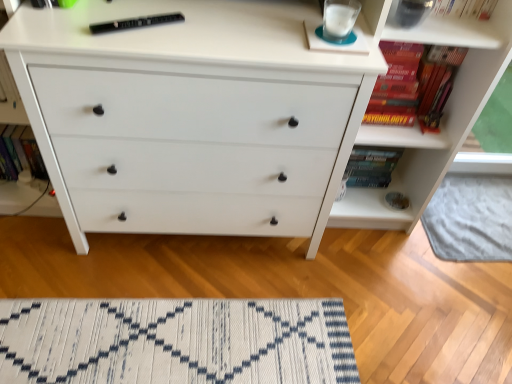
Question: Is white woven mat at lower center further to camera compared to black plastic remote at upper center, the third book viewed from the right?

Choices:
 (A) no
 (B) yes

Answer: (B)

Question: Is black plastic remote at upper center, placed as the second book when sorted from left to right, a part of white woven mat at lower center?

Choices:
 (A) yes
 (B) no

Answer: (B)

Question: Is the depth of white woven mat at lower center less than that of black plastic remote at upper center, placed as the second book when sorted from left to right?

Choices:
 (A) yes
 (B) no

Answer: (B)

Question: Does white woven mat at lower center have a smaller size compared to black plastic remote at upper center, placed as the second book when sorted from left to right?

Choices:
 (A) yes
 (B) no

Answer: (B)

Question: Considering the relative sizes of white woven mat at lower center and black plastic remote at upper center, placed as the second book when sorted from left to right, in the image provided, is white woven mat at lower center bigger than black plastic remote at upper center, placed as the second book when sorted from left to right,?

Choices:
 (A) yes
 (B) no

Answer: (A)

Question: Is white woven mat at lower center positioned beyond the bounds of black plastic remote at upper center, the third book viewed from the right?

Choices:
 (A) yes
 (B) no

Answer: (A)

Question: From a real-world perspective, is hardcover book at left, marked as the 4th book in a right-to-left arrangement, located beneath white textured rug at lower center?

Choices:
 (A) yes
 (B) no

Answer: (B)

Question: Is the depth of hardcover book at left, marked as the 4th book in a right-to-left arrangement, less than that of white textured rug at lower center?

Choices:
 (A) no
 (B) yes

Answer: (B)

Question: From a real-world perspective, is hardcover book at left, marked as the 4th book in a right-to-left arrangement, physically above white textured rug at lower center?

Choices:
 (A) no
 (B) yes

Answer: (B)

Question: Considering the relative sizes of hardcover book at left, acting as the first book starting from the left, and white textured rug at lower center in the image provided, is hardcover book at left, acting as the first book starting from the left, smaller than white textured rug at lower center?

Choices:
 (A) yes
 (B) no

Answer: (A)

Question: From the image's perspective, is hardcover book at left, marked as the 4th book in a right-to-left arrangement, on white textured rug at lower center?

Choices:
 (A) yes
 (B) no

Answer: (A)

Question: Does hardcover book at left, marked as the 4th book in a right-to-left arrangement, have a lesser width compared to white textured rug at lower center?

Choices:
 (A) no
 (B) yes

Answer: (B)

Question: Is white matte chest of drawers at center inside black plastic remote at upper center, placed as the second book when sorted from left to right?

Choices:
 (A) no
 (B) yes

Answer: (A)